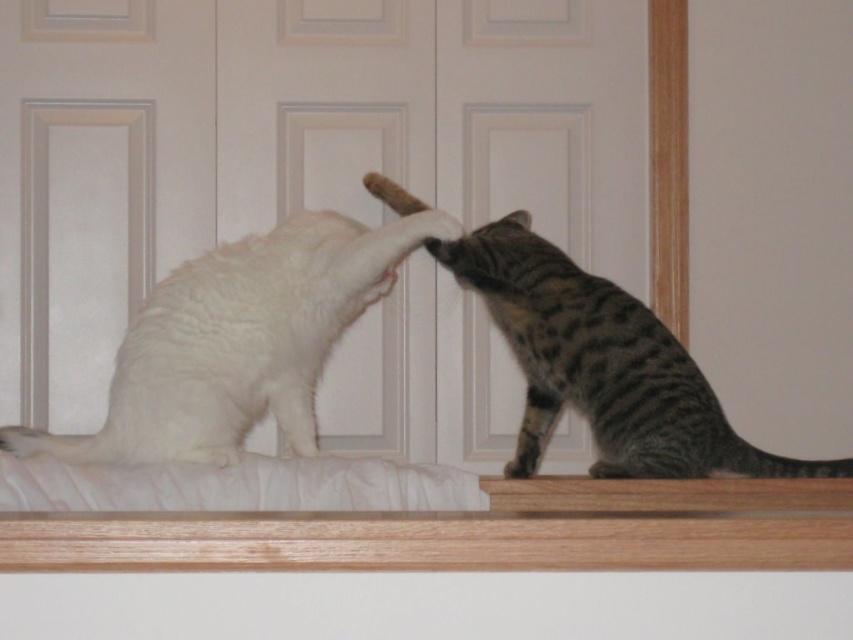
Is white fluffy cat at left wider than gray striped cat at upper right?

In fact, white fluffy cat at left might be narrower than gray striped cat at upper right.

Which is behind, point (247, 321) or point (819, 461)?

The point (819, 461) is behind.

Find the location of a particular element. The height and width of the screenshot is (640, 853). white fluffy cat at left is located at coordinates (239, 340).

You are a GUI agent. You are given a task and a screenshot of the screen. Output one action in this format:
    pyautogui.click(x=<x>, y=<y>)
    Task: Click on the white fluffy cat at left
    This screenshot has height=640, width=853.
    Given the screenshot: What is the action you would take?
    pyautogui.click(x=239, y=340)